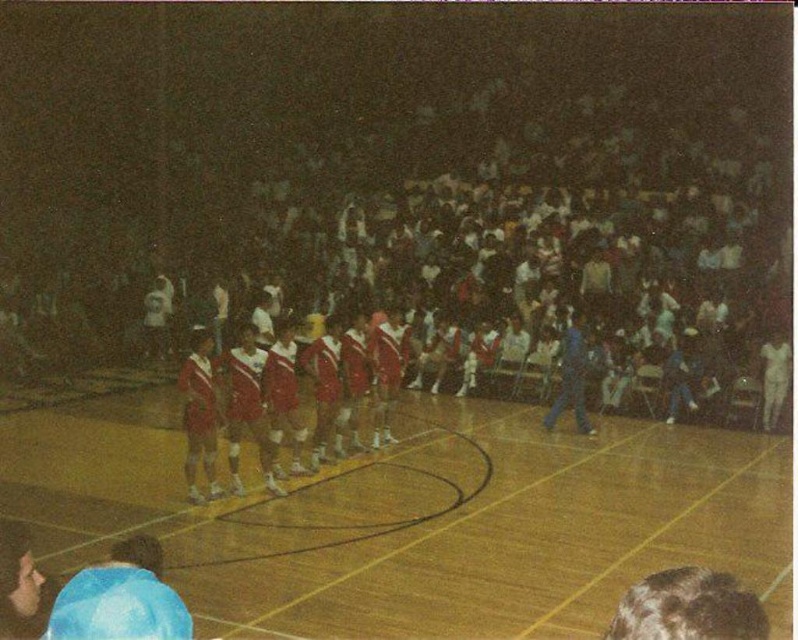
You are a photographer trying to capture a wide shot of the wooden basketball court at center and the red shiny uniform at center. Based on their sizes, which object should you focus on first to ensure both are in frame?

The wooden basketball court at center is wider than the red shiny uniform at center, so you should focus on the wooden basketball court at center first to ensure both fit within the frame.

You are a photographer standing at the edge of the wooden basketball court at center. You want to take a photo of the red shiny uniform at center. Since both objects are at center, which one will appear larger in your photo?

The wooden basketball court at center will appear larger in the photo because it is closer to the viewer than the red shiny uniform at center.